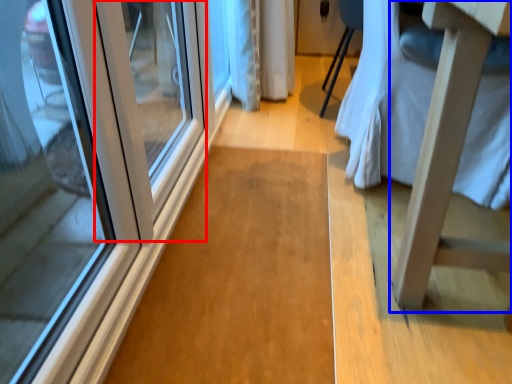
Question: Which of the following is the farthest to the observer, door (highlighted by a red box) or changing table (highlighted by a blue box)?

Choices:
 (A) door
 (B) changing table

Answer: (A)